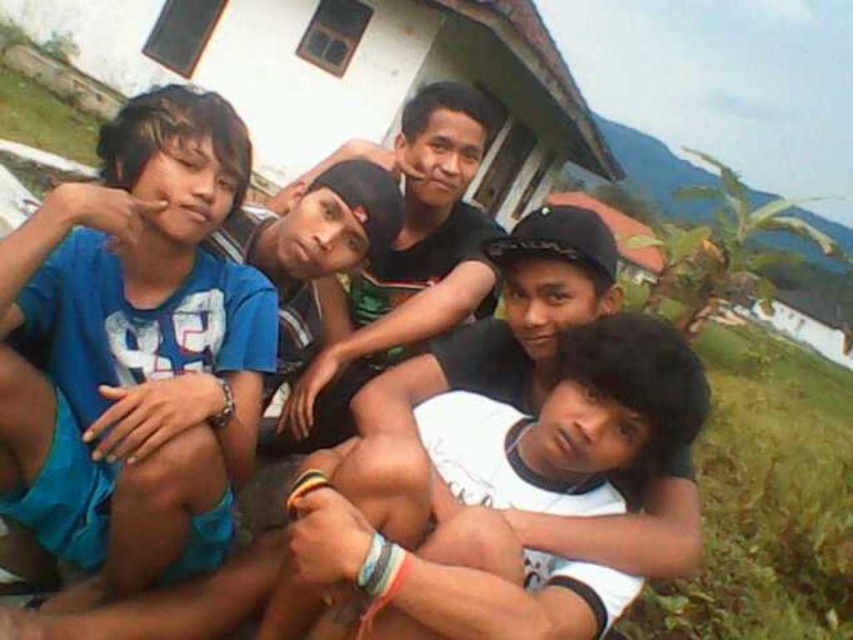
Question: Is white matte shirt at lower center above black matte cap at center?

Choices:
 (A) no
 (B) yes

Answer: (A)

Question: Which point is closer to the camera taking this photo?

Choices:
 (A) (154, 440)
 (B) (361, 330)
 (C) (488, 493)

Answer: (A)

Question: In this image, where is blue matte shirt at left located relative to white matte shirt at lower center?

Choices:
 (A) left
 (B) right

Answer: (A)

Question: In this image, where is blue matte shirt at left located relative to black matte cap at center?

Choices:
 (A) left
 (B) right

Answer: (A)

Question: Which point appears closest to the camera in this image?

Choices:
 (A) (456, 593)
 (B) (132, 189)

Answer: (A)

Question: Which of the following is the closest to the observer?

Choices:
 (A) (589, 456)
 (B) (448, 156)
 (C) (134, 156)

Answer: (A)